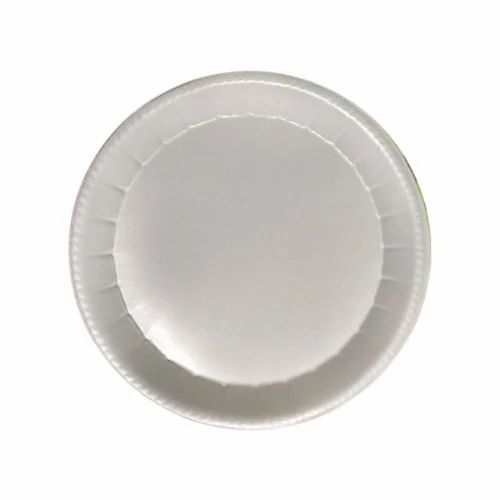
You are a GUI agent. You are given a task and a screenshot of the screen. Output one action in this format:
    pyautogui.click(x=<x>, y=<y>)
    Task: Click on the outer edge of plate
    This screenshot has width=500, height=500.
    Given the screenshot: What is the action you would take?
    pyautogui.click(x=85, y=175)